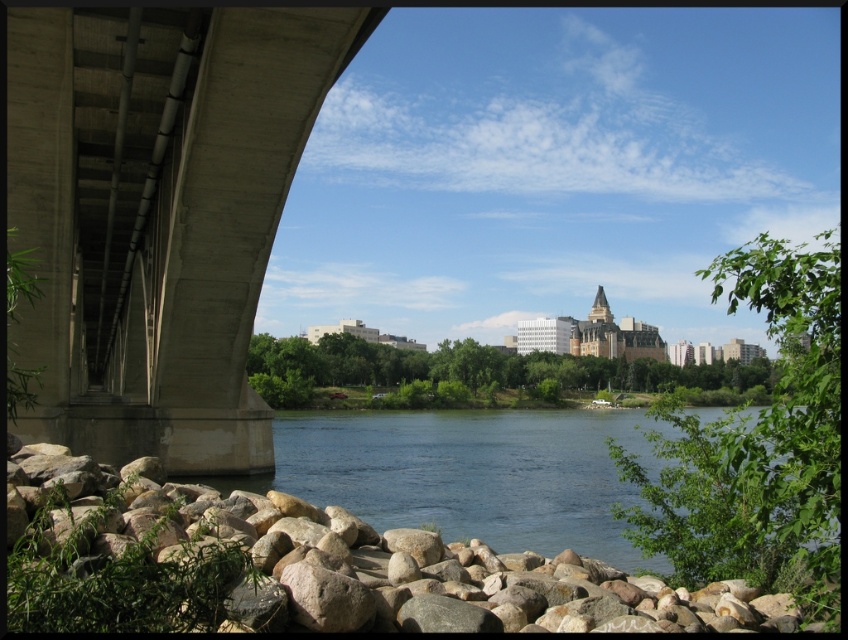
You are a delivery drone that needs to pass under the concrete bridge at left to reach the city across the river. The smooth brown rock at lower left is blocking your path. Can you safely navigate around it without hitting the bridge or the rock?

The concrete bridge at left is wider than the smooth brown rock at lower left, so you can navigate around the rock by staying closer to the bridge structure while ensuring enough clearance between the drone and the rock to pass safely.

You are a surveyor measuring distances between landmarks in the scene. You need to determine if a 20 meter long boat can fit between the concrete bridge at left and the smooth brown rock at lower left. Can it?

The concrete bridge at left and smooth brown rock at lower left are 23.34 meters apart. Since the boat is 20 meters long, it can fit between them as the distance is sufficient.

You are standing at the center of the rocky shoreline and want to walk towards the concrete bridge at left. Which direction should you head?

The concrete bridge at left is located at point (x=159, y=214), so you should head towards the left direction to reach it.